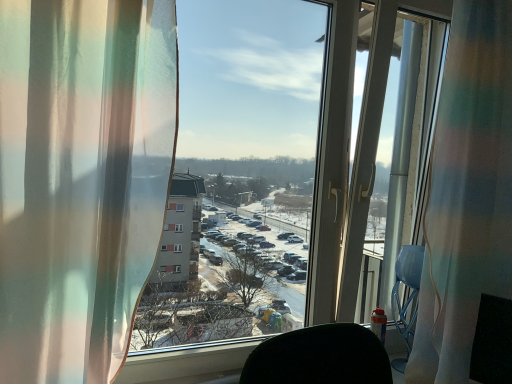
The height and width of the screenshot is (384, 512). Describe the element at coordinates (81, 179) in the screenshot. I see `translucent sheer curtain at left, the first curtain viewed from the left` at that location.

Based on the photo, in order to face translucent fabric at center, should I rotate leftwards or rightwards?

You should rotate right by 3.858 degrees.

The height and width of the screenshot is (384, 512). Describe the element at coordinates (236, 171) in the screenshot. I see `translucent fabric at center` at that location.

Identify the location of translucent fabric curtain at right, which ranks as the first curtain in back-to-front order. Image resolution: width=512 pixels, height=384 pixels. (467, 193).

From a real-world perspective, which object stands above the other?

translucent fabric at center, from a real-world perspective.

Is translucent sheer curtain at left, which is the first curtain from front to back, oriented away from translucent fabric at center?

No.

Which object is wider, translucent sheer curtain at left, the second curtain viewed from the right, or translucent fabric at center?

translucent sheer curtain at left, the second curtain viewed from the right.

Is translucent fabric curtain at right, which ranks as the first curtain in back-to-front order, smaller than translucent sheer curtain at left, arranged as the 2th curtain when viewed from the back?

Incorrect, translucent fabric curtain at right, which ranks as the first curtain in back-to-front order, is not smaller in size than translucent sheer curtain at left, arranged as the 2th curtain when viewed from the back.

Does point (470, 279) come in front of point (134, 85)?

No, it is not.

The width and height of the screenshot is (512, 384). I want to click on curtain located on the left of translucent fabric curtain at right, arranged as the first curtain when viewed from the right, so click(81, 179).

Is translucent fabric curtain at right, which ranks as the first curtain in back-to-front order, taller than translucent sheer curtain at left, which is the first curtain from front to back?

Yes.

From a real-world perspective, is translucent fabric curtain at right, which is the second curtain from front to back, over translucent fabric at center?

Actually, translucent fabric curtain at right, which is the second curtain from front to back, is physically below translucent fabric at center in the real world.

Consider the image. Is translucent fabric curtain at right, arranged as the first curtain when viewed from the right, turned away from translucent fabric at center?

No, translucent fabric at center is not at the back of translucent fabric curtain at right, arranged as the first curtain when viewed from the right.

Considering the sizes of translucent fabric curtain at right, positioned as the 2th curtain in left-to-right order, and translucent fabric at center in the image, is translucent fabric curtain at right, positioned as the 2th curtain in left-to-right order, wider or thinner than translucent fabric at center?

Considering their sizes, translucent fabric curtain at right, positioned as the 2th curtain in left-to-right order, looks broader than translucent fabric at center.

How many degrees apart are the facing directions of translucent fabric curtain at right, positioned as the 2th curtain in left-to-right order, and translucent fabric at center?

The angle between the facing direction of translucent fabric curtain at right, positioned as the 2th curtain in left-to-right order, and the facing direction of translucent fabric at center is 0.593 degrees.

From the image's perspective, is translucent sheer curtain at left, the second curtain viewed from the right, located beneath translucent fabric curtain at right, positioned as the 2th curtain in left-to-right order?

Indeed, from the image's perspective, translucent sheer curtain at left, the second curtain viewed from the right, is shown beneath translucent fabric curtain at right, positioned as the 2th curtain in left-to-right order.

Who is bigger, translucent sheer curtain at left, the first curtain viewed from the left, or translucent fabric curtain at right, positioned as the 2th curtain in left-to-right order?

translucent fabric curtain at right, positioned as the 2th curtain in left-to-right order, is bigger.

Locate an element on the screen. The width and height of the screenshot is (512, 384). curtain on the right of translucent sheer curtain at left, which is the first curtain from front to back is located at coordinates (467, 193).

Is translucent fabric at center situated inside translucent fabric curtain at right, positioned as the 2th curtain in left-to-right order, or outside?

translucent fabric at center is outside translucent fabric curtain at right, positioned as the 2th curtain in left-to-right order.

Considering the sizes of objects translucent fabric at center and translucent fabric curtain at right, which is the second curtain from front to back, in the image provided, who is taller, translucent fabric at center or translucent fabric curtain at right, which is the second curtain from front to back,?

With more height is translucent fabric curtain at right, which is the second curtain from front to back.

This screenshot has height=384, width=512. Identify the location of the 1st curtain located beneath the translucent fabric at center (from a real-world perspective). (467, 193).

Which object is further away from the camera taking this photo, translucent fabric at center or translucent fabric curtain at right, which ranks as the first curtain in back-to-front order?

Positioned behind is translucent fabric curtain at right, which ranks as the first curtain in back-to-front order.

From a real-world perspective, relative to translucent sheer curtain at left, the second curtain viewed from the right, is translucent fabric at center vertically above or below?

Clearly, from a real-world perspective, translucent fabric at center is above translucent sheer curtain at left, the second curtain viewed from the right.

Does translucent fabric at center have a greater height compared to translucent sheer curtain at left, the second curtain viewed from the right?

Correct, translucent fabric at center is much taller as translucent sheer curtain at left, the second curtain viewed from the right.

Is translucent fabric at center facing away from translucent sheer curtain at left, which is the first curtain from front to back?

That's not correct — translucent fabric at center is not looking away from translucent sheer curtain at left, which is the first curtain from front to back.

Is point (276, 292) behind point (40, 367)?

Yes, point (276, 292) is farther from viewer.

Find the location of a particular element. This screenshot has height=384, width=512. window screen behind the translucent sheer curtain at left, the first curtain viewed from the left is located at coordinates (236, 171).

Locate an element on the screen. The image size is (512, 384). curtain above the translucent sheer curtain at left, the first curtain viewed from the left (from a real-world perspective) is located at coordinates (467, 193).

In the scene shown: Estimate the real-world distances between objects in this image. Which object is closer to translucent sheer curtain at left, the first curtain viewed from the left, translucent fabric at center or translucent fabric curtain at right, which ranks as the first curtain in back-to-front order?

The object closer to translucent sheer curtain at left, the first curtain viewed from the left, is translucent fabric curtain at right, which ranks as the first curtain in back-to-front order.

Looking at the image, which one is located further to translucent sheer curtain at left, arranged as the 2th curtain when viewed from the back, translucent fabric curtain at right, which ranks as the first curtain in back-to-front order, or translucent fabric at center?

translucent fabric at center is positioned further to the anchor translucent sheer curtain at left, arranged as the 2th curtain when viewed from the back.

Looking at the image, which one is located closer to translucent fabric at center, translucent fabric curtain at right, positioned as the 2th curtain in left-to-right order, or translucent sheer curtain at left, the second curtain viewed from the right?

translucent fabric curtain at right, positioned as the 2th curtain in left-to-right order, is closer to translucent fabric at center.

In the scene shown: Estimate the real-world distances between objects in this image. Which object is closer to translucent fabric curtain at right, which is the second curtain from front to back, translucent fabric at center or translucent sheer curtain at left, the first curtain viewed from the left?

Among the two, translucent sheer curtain at left, the first curtain viewed from the left, is located nearer to translucent fabric curtain at right, which is the second curtain from front to back.

Which object lies further to the anchor point translucent fabric at center, translucent sheer curtain at left, the second curtain viewed from the right, or translucent fabric curtain at right, which is the second curtain from front to back?

Among the two, translucent sheer curtain at left, the second curtain viewed from the right, is located further to translucent fabric at center.

Estimate the real-world distances between objects in this image. Which object is further from translucent fabric curtain at right, which ranks as the first curtain in back-to-front order, translucent sheer curtain at left, arranged as the 2th curtain when viewed from the back, or translucent fabric at center?

translucent fabric at center is further to translucent fabric curtain at right, which ranks as the first curtain in back-to-front order.

Where is `window screen between translucent sheer curtain at left, arranged as the 2th curtain when viewed from the back, and translucent fabric curtain at right, arranged as the first curtain when viewed from the right`? The width and height of the screenshot is (512, 384). window screen between translucent sheer curtain at left, arranged as the 2th curtain when viewed from the back, and translucent fabric curtain at right, arranged as the first curtain when viewed from the right is located at coordinates (236, 171).